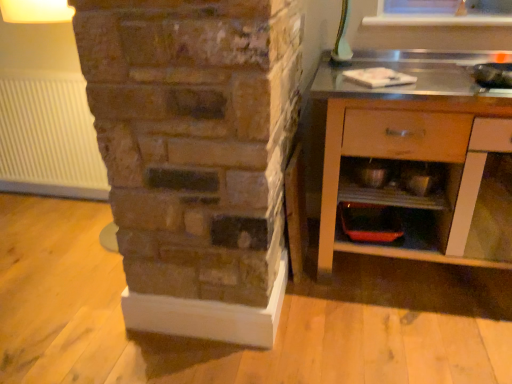
Find the location of a particular element. Image resolution: width=512 pixels, height=384 pixels. wooden cabinet at right is located at coordinates (416, 162).

How different are the orientations of metallic silver bowls at lower right, placed as the 1th shelf when sorted from top to bottom, and wooden cabinet at right in degrees?

0.131 degrees.

Which object is wider, metallic silver bowls at lower right, the second shelf in the bottom-to-top sequence, or wooden cabinet at right?

With larger width is wooden cabinet at right.

Considering the positions of objects metallic silver bowls at lower right, the second shelf in the bottom-to-top sequence, and wooden cabinet at right in the image provided, who is more to the right, metallic silver bowls at lower right, the second shelf in the bottom-to-top sequence, or wooden cabinet at right?

Positioned to the right is wooden cabinet at right.

Who is smaller, metallic silver bowls at lower right, placed as the 1th shelf when sorted from top to bottom, or wooden cabinet at right?

Smaller between the two is metallic silver bowls at lower right, placed as the 1th shelf when sorted from top to bottom.

From a real-world perspective, is metallic silver bowls at lower right, placed as the 1th shelf when sorted from top to bottom, positioned over matte orange tray at lower center, the 1th shelf ordered from the bottom, based on gravity?

Yes, from a real-world perspective, metallic silver bowls at lower right, placed as the 1th shelf when sorted from top to bottom, is on top of matte orange tray at lower center, the 1th shelf ordered from the bottom.

Considering the relative sizes of metallic silver bowls at lower right, placed as the 1th shelf when sorted from top to bottom, and matte orange tray at lower center, the 2th shelf positioned from the top, in the image provided, is metallic silver bowls at lower right, placed as the 1th shelf when sorted from top to bottom, bigger than matte orange tray at lower center, the 2th shelf positioned from the top,?

Correct, metallic silver bowls at lower right, placed as the 1th shelf when sorted from top to bottom, is larger in size than matte orange tray at lower center, the 2th shelf positioned from the top.

Considering the relative sizes of metallic silver bowls at lower right, placed as the 1th shelf when sorted from top to bottom, and matte orange tray at lower center, the 2th shelf positioned from the top, in the image provided, is metallic silver bowls at lower right, placed as the 1th shelf when sorted from top to bottom, wider than matte orange tray at lower center, the 2th shelf positioned from the top,?

Yes, metallic silver bowls at lower right, placed as the 1th shelf when sorted from top to bottom, is wider than matte orange tray at lower center, the 2th shelf positioned from the top.

Is metallic silver bowls at lower right, placed as the 1th shelf when sorted from top to bottom, shorter than matte orange tray at lower center, the 2th shelf positioned from the top?

In fact, metallic silver bowls at lower right, placed as the 1th shelf when sorted from top to bottom, may be taller than matte orange tray at lower center, the 2th shelf positioned from the top.

Which of these two, wooden cabinet at right or white ribbed radiator at left, stands shorter?

white ribbed radiator at left is shorter.

From the image's perspective, relative to white ribbed radiator at left, is wooden cabinet at right above or below?

wooden cabinet at right is situated lower than white ribbed radiator at left in the image.

Considering the relative sizes of wooden cabinet at right and white ribbed radiator at left in the image provided, is wooden cabinet at right thinner than white ribbed radiator at left?

In fact, wooden cabinet at right might be wider than white ribbed radiator at left.

Does white ribbed radiator at left lie behind wooden cabinet at right?

Yes, white ribbed radiator at left is further from the camera.

Is white ribbed radiator at left positioned far away from wooden cabinet at right?

white ribbed radiator at left is positioned a significant distance from wooden cabinet at right.

Can you tell me how much white ribbed radiator at left and wooden cabinet at right differ in facing direction?

white ribbed radiator at left and wooden cabinet at right are facing 0.0447 degrees away from each other.

How far apart are white ribbed radiator at left and wooden cabinet at right?

white ribbed radiator at left and wooden cabinet at right are 5.41 feet apart from each other.

Is white ribbed radiator at left oriented towards metallic silver bowls at lower right, the second shelf in the bottom-to-top sequence?

No, white ribbed radiator at left is not turned towards metallic silver bowls at lower right, the second shelf in the bottom-to-top sequence.

How many degrees apart are the facing directions of white ribbed radiator at left and metallic silver bowls at lower right, the second shelf in the bottom-to-top sequence?

The angle between the facing direction of white ribbed radiator at left and the facing direction of metallic silver bowls at lower right, the second shelf in the bottom-to-top sequence, is 0.175 degrees.

Does white ribbed radiator at left appear on the right side of metallic silver bowls at lower right, placed as the 1th shelf when sorted from top to bottom?

No.

In the image, is matte orange tray at lower center, the 2th shelf positioned from the top, positioned in front of or behind metallic silver bowls at lower right, placed as the 1th shelf when sorted from top to bottom?

matte orange tray at lower center, the 2th shelf positioned from the top, is behind metallic silver bowls at lower right, placed as the 1th shelf when sorted from top to bottom.

Which of these two, matte orange tray at lower center, the 1th shelf ordered from the bottom, or metallic silver bowls at lower right, placed as the 1th shelf when sorted from top to bottom, is thinner?

matte orange tray at lower center, the 1th shelf ordered from the bottom.

How much distance is there between matte orange tray at lower center, the 1th shelf ordered from the bottom, and metallic silver bowls at lower right, placed as the 1th shelf when sorted from top to bottom?

matte orange tray at lower center, the 1th shelf ordered from the bottom, is 7.05 inches from metallic silver bowls at lower right, placed as the 1th shelf when sorted from top to bottom.

Are matte orange tray at lower center, the 1th shelf ordered from the bottom, and metallic silver bowls at lower right, the second shelf in the bottom-to-top sequence, beside each other?

No, matte orange tray at lower center, the 1th shelf ordered from the bottom, is not beside metallic silver bowls at lower right, the second shelf in the bottom-to-top sequence.

Is metallic silver bowls at lower right, placed as the 1th shelf when sorted from top to bottom, wider or thinner than white ribbed radiator at left?

In the image, metallic silver bowls at lower right, placed as the 1th shelf when sorted from top to bottom, appears to be wider than white ribbed radiator at left.

Could you tell me if metallic silver bowls at lower right, the second shelf in the bottom-to-top sequence, is turned towards white ribbed radiator at left?

No, metallic silver bowls at lower right, the second shelf in the bottom-to-top sequence, is not aimed at white ribbed radiator at left.

Who is more distant, metallic silver bowls at lower right, the second shelf in the bottom-to-top sequence, or white ribbed radiator at left?

Positioned behind is white ribbed radiator at left.

I want to click on the chest of drawers lying in front of the metallic silver bowls at lower right, the second shelf in the bottom-to-top sequence, so click(416, 162).

Locate an element on the screen. The width and height of the screenshot is (512, 384). shelf below the metallic silver bowls at lower right, the second shelf in the bottom-to-top sequence (from a real-world perspective) is located at coordinates (387, 226).

When comparing their distances from matte orange tray at lower center, the 1th shelf ordered from the bottom, does metallic silver bowls at lower right, the second shelf in the bottom-to-top sequence, or wooden cabinet at right seem further?

wooden cabinet at right is further to matte orange tray at lower center, the 1th shelf ordered from the bottom.

When comparing their distances from matte orange tray at lower center, the 2th shelf positioned from the top, does metallic silver bowls at lower right, placed as the 1th shelf when sorted from top to bottom, or white ribbed radiator at left seem closer?

Based on the image, metallic silver bowls at lower right, placed as the 1th shelf when sorted from top to bottom, appears to be nearer to matte orange tray at lower center, the 2th shelf positioned from the top.

Estimate the real-world distances between objects in this image. Which object is further from wooden cabinet at right, white ribbed radiator at left or matte orange tray at lower center, the 1th shelf ordered from the bottom?

Based on the image, white ribbed radiator at left appears to be further to wooden cabinet at right.

Based on their spatial positions, is white ribbed radiator at left or wooden cabinet at right further from metallic silver bowls at lower right, placed as the 1th shelf when sorted from top to bottom?

Based on the image, white ribbed radiator at left appears to be further to metallic silver bowls at lower right, placed as the 1th shelf when sorted from top to bottom.

Which object lies nearer to the anchor point white ribbed radiator at left, metallic silver bowls at lower right, placed as the 1th shelf when sorted from top to bottom, or wooden cabinet at right?

wooden cabinet at right is positioned closer to the anchor white ribbed radiator at left.

Considering their positions, is matte orange tray at lower center, the 2th shelf positioned from the top, positioned further to white ribbed radiator at left than wooden cabinet at right?

matte orange tray at lower center, the 2th shelf positioned from the top, is further to white ribbed radiator at left.

Looking at this image, estimate the real-world distances between objects in this image. Which object is closer to wooden cabinet at right, matte orange tray at lower center, the 2th shelf positioned from the top, or white ribbed radiator at left?

The object closer to wooden cabinet at right is matte orange tray at lower center, the 2th shelf positioned from the top.

Which object lies further to the anchor point wooden cabinet at right, metallic silver bowls at lower right, the second shelf in the bottom-to-top sequence, or white ribbed radiator at left?

Based on the image, white ribbed radiator at left appears to be further to wooden cabinet at right.

At what (x,y) coordinates should I click in order to perform the action: click on shelf between white ribbed radiator at left and metallic silver bowls at lower right, placed as the 1th shelf when sorted from top to bottom. Please return your answer as a coordinate pair (x, y). Image resolution: width=512 pixels, height=384 pixels. Looking at the image, I should click on (387, 226).

This screenshot has height=384, width=512. I want to click on shelf between wooden cabinet at right and matte orange tray at lower center, the 1th shelf ordered from the bottom, along the z-axis, so click(x=395, y=183).